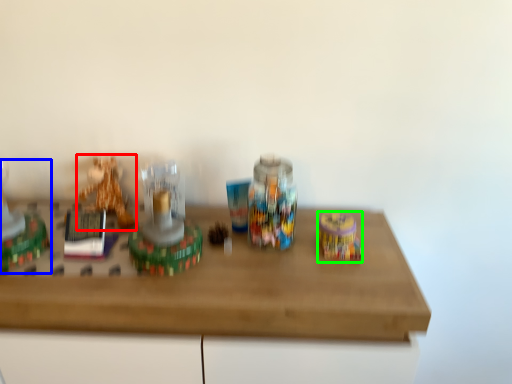
Question: Based on their relative distances, which object is farther from toy (highlighted by a red box)? Choose from toy (highlighted by a blue box) and toy (highlighted by a green box).

Choices:
 (A) toy
 (B) toy

Answer: (B)